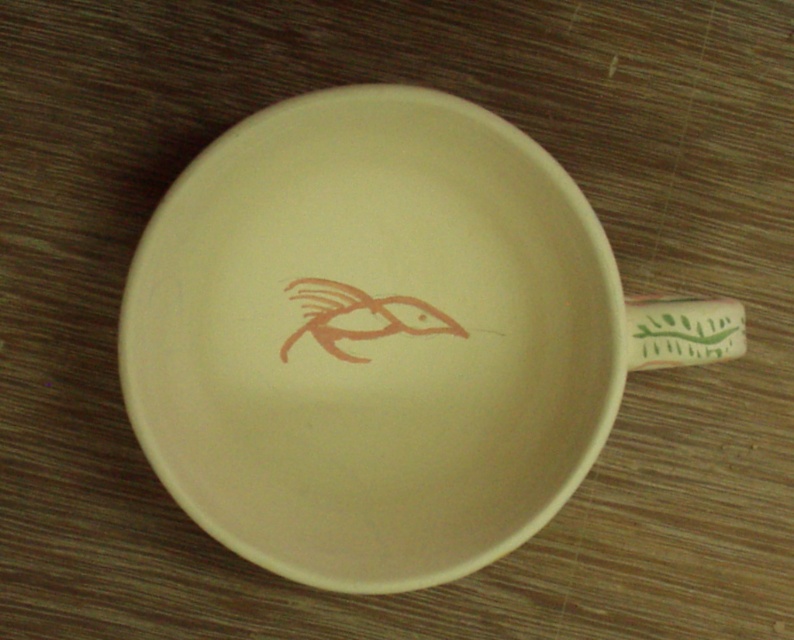
Question: Which of the following is the closest to the observer?

Choices:
 (A) (700, 328)
 (B) (392, 192)

Answer: (A)

Question: Does matte ceramic saucer at center appear under green leafy design at right?

Choices:
 (A) yes
 (B) no

Answer: (A)

Question: Can you confirm if matte ceramic saucer at center is wider than green leafy design at right?

Choices:
 (A) yes
 (B) no

Answer: (A)

Question: Is matte ceramic saucer at center bigger than green leafy design at right?

Choices:
 (A) no
 (B) yes

Answer: (B)